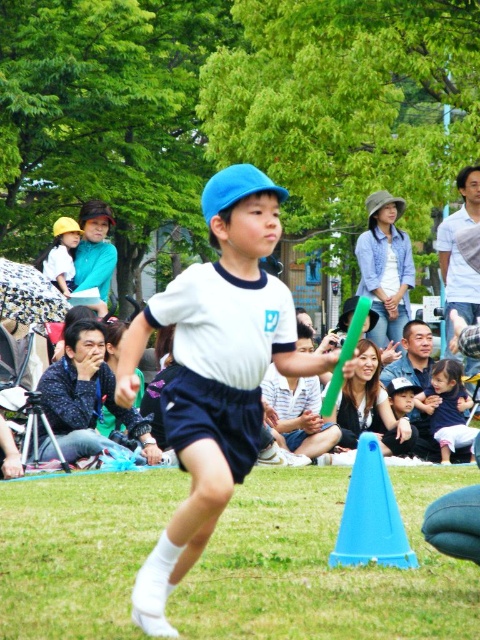
Can you confirm if blue plastic cone at lower center is thinner than white cotton shirt at center?

Yes, blue plastic cone at lower center is thinner than white cotton shirt at center.

Between point (398, 513) and point (456, 256), which one is positioned behind?

Positioned behind is point (456, 256).

Locate an element on the screen. The image size is (480, 640). blue plastic cone at lower center is located at coordinates (371, 515).

Is matte black shirt at lower left shorter than matte yellow helmet at upper left?

In fact, matte black shirt at lower left may be taller than matte yellow helmet at upper left.

Measure the distance between matte black shirt at lower left and camera.

The distance of matte black shirt at lower left from camera is 45.14 feet.

Between point (79, 397) and point (70, 291), which one is positioned in front?

Point (79, 397)

Find the location of a particular element. matte black shirt at lower left is located at coordinates (87, 396).

Which of these two, white matte uniform at center or white cotton shirt at center, stands taller?

white matte uniform at center

Who is lower down, white matte uniform at center or white cotton shirt at center?

white matte uniform at center

Identify the location of white matte uniform at center. (215, 371).